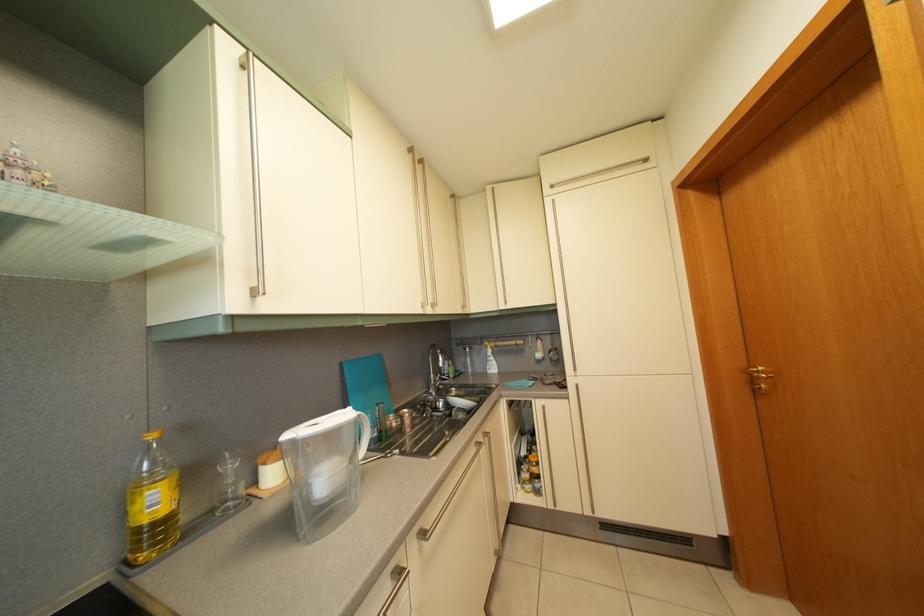
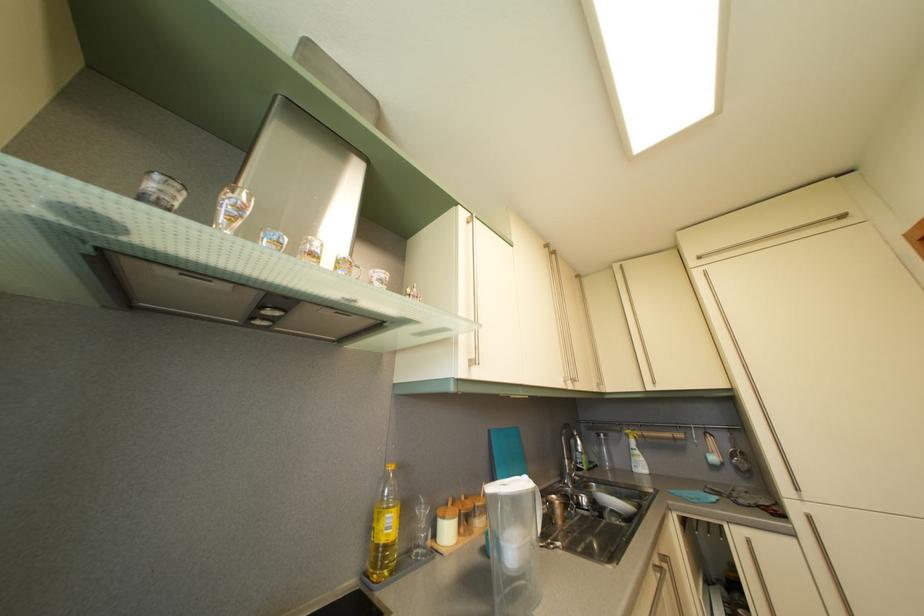
Find the pixel in the second image that matches (x=164, y=509) in the first image.

(396, 533)